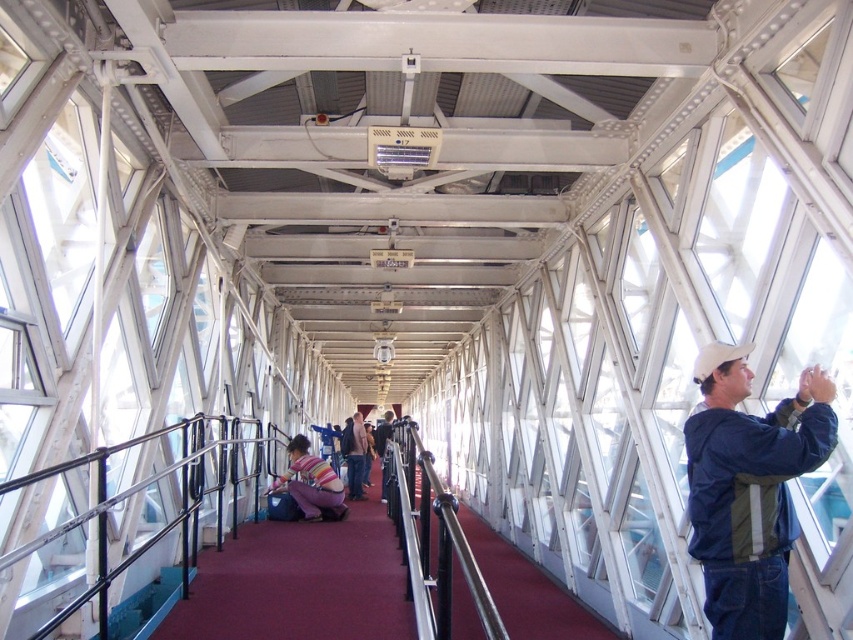
Question: Does metallic black railing at center have a greater width compared to blue fabric jacket at right?

Choices:
 (A) yes
 (B) no

Answer: (B)

Question: Among these points, which one is farthest from the camera?

Choices:
 (A) (743, 371)
 (B) (355, 486)

Answer: (B)

Question: Which point is farther from the camera taking this photo?

Choices:
 (A) (344, 433)
 (B) (325, 499)

Answer: (A)

Question: Which object appears closest to the camera in this image?

Choices:
 (A) striped fabric shirt at center
 (B) black metal/rail at center
 (C) striped sweater at center
 (D) metallic black railing at center

Answer: (B)

Question: Is blue fabric jacket at right above black metal/rail at center?

Choices:
 (A) yes
 (B) no

Answer: (A)

Question: Does metallic black railing at center have a larger size compared to black metal/rail at center?

Choices:
 (A) yes
 (B) no

Answer: (A)